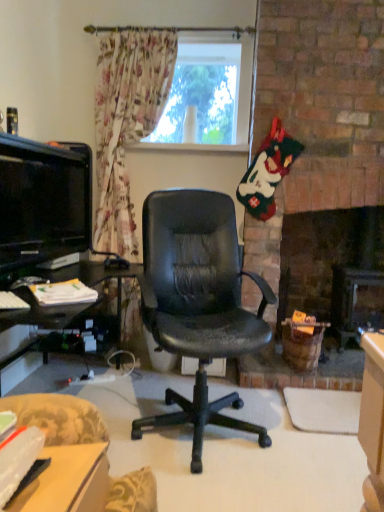
I want to click on free space above matte plastic desk at lower left (from a real-world perspective), so click(49, 490).